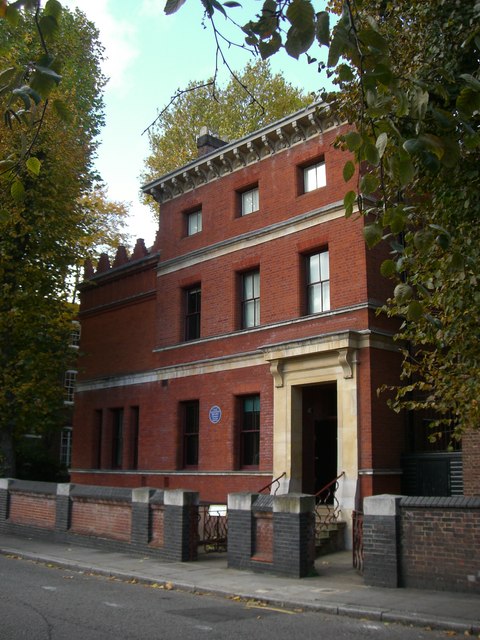
Identify the location of doorway. The width and height of the screenshot is (480, 640). (296, 438).